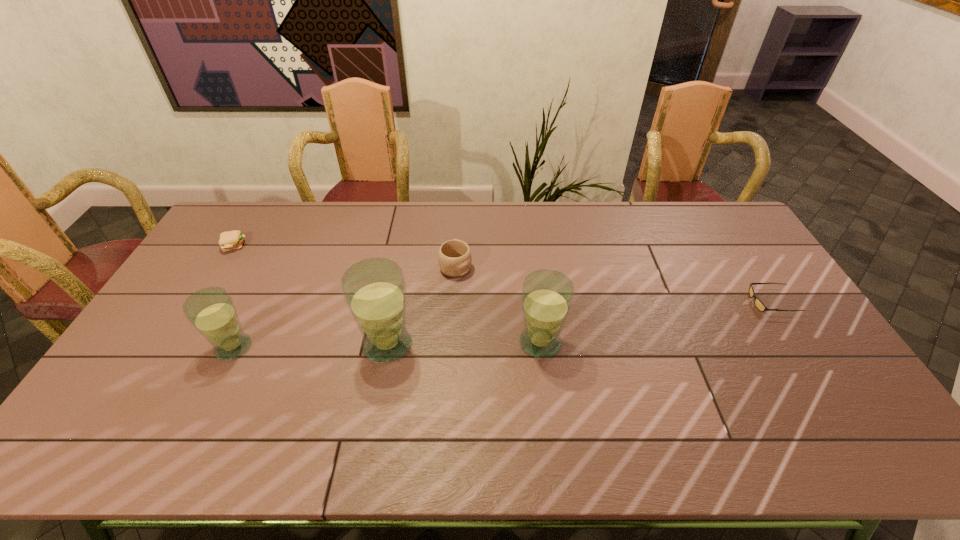
Identify the location of free space between the shortest glass and the fourth nearest object. The height and width of the screenshot is (540, 960). (502, 325).

The image size is (960, 540). I want to click on vacant space in between the second tallest object and the second glass from right to left, so [x=464, y=344].

Where is `empty space that is in between the second tallest glass and the fourth object from right to left`? The image size is (960, 540). empty space that is in between the second tallest glass and the fourth object from right to left is located at coordinates (464, 344).

Locate an element on the screen. This screenshot has height=540, width=960. vacant area that lies between the fifth tallest object and the mug is located at coordinates (345, 255).

This screenshot has width=960, height=540. I want to click on vacant point located between the rightmost glass and the sunglasses, so click(656, 322).

The height and width of the screenshot is (540, 960). I want to click on free spot between the fifth tallest object and the mug, so click(x=345, y=255).

Image resolution: width=960 pixels, height=540 pixels. Find the location of `vacant region between the third tallest object and the fourth object from left to right`. vacant region between the third tallest object and the fourth object from left to right is located at coordinates (345, 306).

Find the location of a particular element. free spot between the second glass from left to right and the fifth object from right to left is located at coordinates (311, 346).

Locate which object is the third closest to the patty. Please provide its 2D coordinates. Your answer should be formatted as a tuple, i.e. [(x, y)], where the tuple contains the x and y coordinates of a point satisfying the conditions above.

[(454, 257)]

Identify the location of object that is the closest one to the third object from left to right. (454, 257).